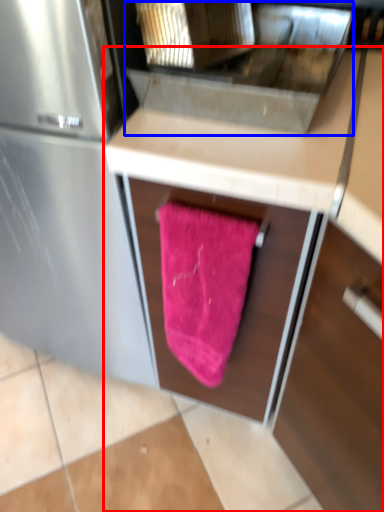
Question: Among these objects, which one is nearest to the camera, cabinetry (highlighted by a red box) or sink (highlighted by a blue box)?

Choices:
 (A) cabinetry
 (B) sink

Answer: (A)